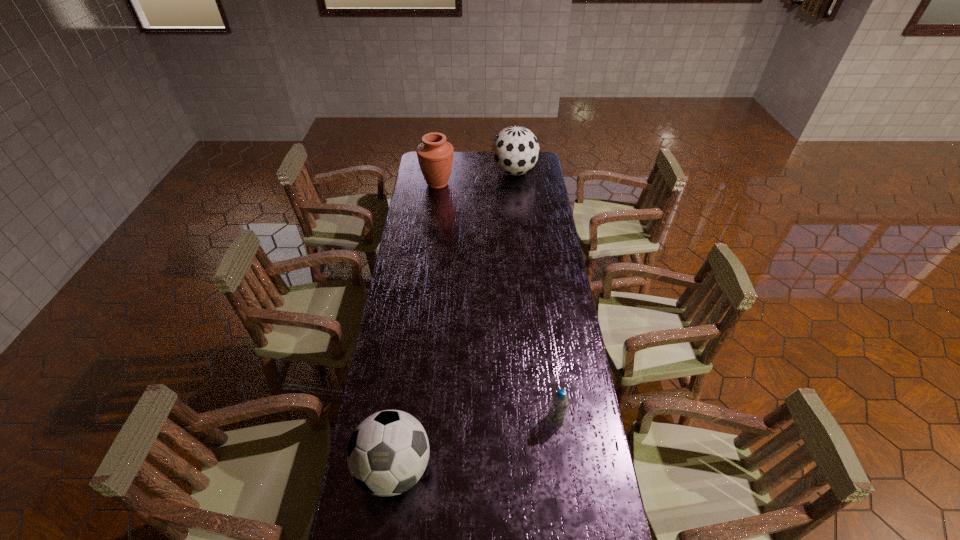
Identify the location of free space between the shorter soccer ball and the vase. The height and width of the screenshot is (540, 960). (416, 326).

At what (x,y) coordinates should I click in order to perform the action: click on vacant space that is in between the right soccer ball and the vase. Please return your answer as a coordinate pair (x, y). Looking at the image, I should click on (476, 178).

At what (x,y) coordinates should I click in order to perform the action: click on vacant region between the vase and the shortest object. Please return your answer as a coordinate pair (x, y). Looking at the image, I should click on (497, 301).

In order to click on empty space that is in between the water bottle and the nearest object in this screenshot , I will do `click(475, 443)`.

At what (x,y) coordinates should I click in order to perform the action: click on vacant region between the vase and the farther soccer ball. Please return your answer as a coordinate pair (x, y). The height and width of the screenshot is (540, 960). Looking at the image, I should click on coord(476,178).

This screenshot has height=540, width=960. Identify the location of free spot between the third farthest object and the vase. (497, 301).

This screenshot has height=540, width=960. What are the coordinates of `empty space between the second nearest object and the shorter soccer ball` in the screenshot? It's located at (475, 443).

Locate an element on the screen. The width and height of the screenshot is (960, 540). unoccupied area between the left soccer ball and the vase is located at coordinates pos(416,326).

Select which object appears as the third closest to the right soccer ball. Please provide its 2D coordinates. Your answer should be formatted as a tuple, i.e. [(x, y)], where the tuple contains the x and y coordinates of a point satisfying the conditions above.

[(387, 454)]

Identify which object is located as the nearest to the vase. Please provide its 2D coordinates. Your answer should be formatted as a tuple, i.e. [(x, y)], where the tuple contains the x and y coordinates of a point satisfying the conditions above.

[(515, 150)]